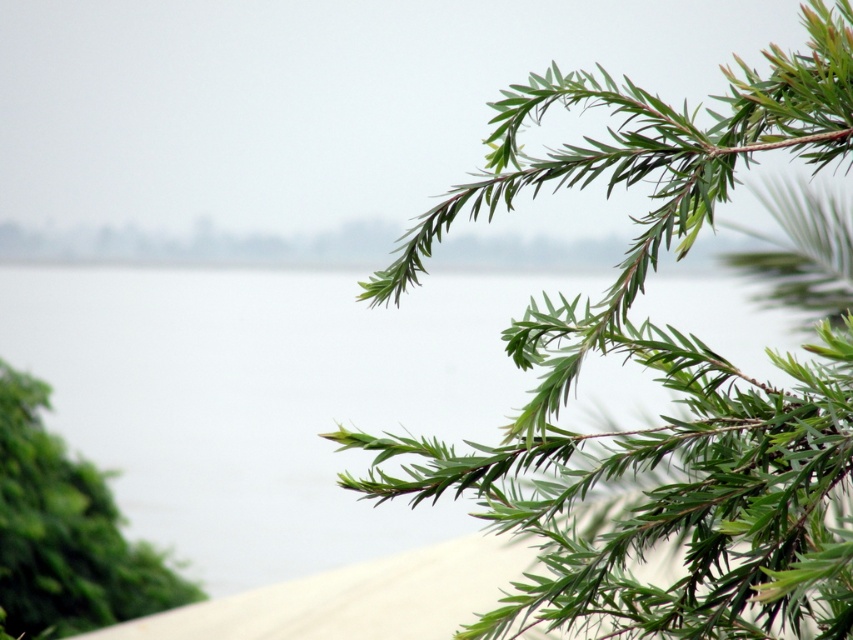
Question: Which point is farther to the camera?

Choices:
 (A) green needle-like leaves at upper right
 (B) green leafy branch at lower left
 (C) transparent water at upper center

Answer: (B)

Question: Does transparent water at upper center have a smaller size compared to green leafy branch at lower left?

Choices:
 (A) no
 (B) yes

Answer: (A)

Question: Does transparent water at upper center have a larger size compared to green leafy branch at lower left?

Choices:
 (A) no
 (B) yes

Answer: (B)

Question: Is the position of green needle-like leaves at upper right less distant than that of transparent water at upper center?

Choices:
 (A) no
 (B) yes

Answer: (B)

Question: Which of these objects is positioned farthest from the transparent water at upper center?

Choices:
 (A) green needle-like leaves at upper right
 (B) green leafy branch at lower left

Answer: (A)

Question: Which object appears farthest from the camera in this image?

Choices:
 (A) transparent water at upper center
 (B) green needle-like leaves at upper right

Answer: (A)